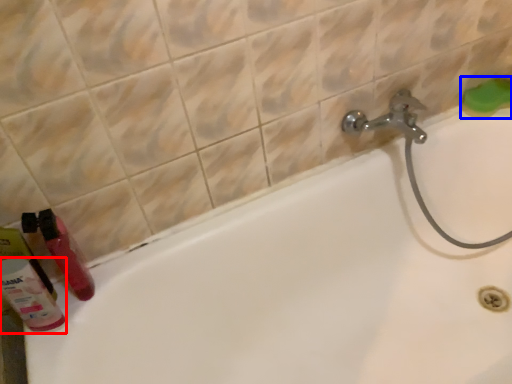
Question: Which object is closer to the camera taking this photo, cleaning product (highlighted by a red box) or soap (highlighted by a blue box)?

Choices:
 (A) cleaning product
 (B) soap

Answer: (A)